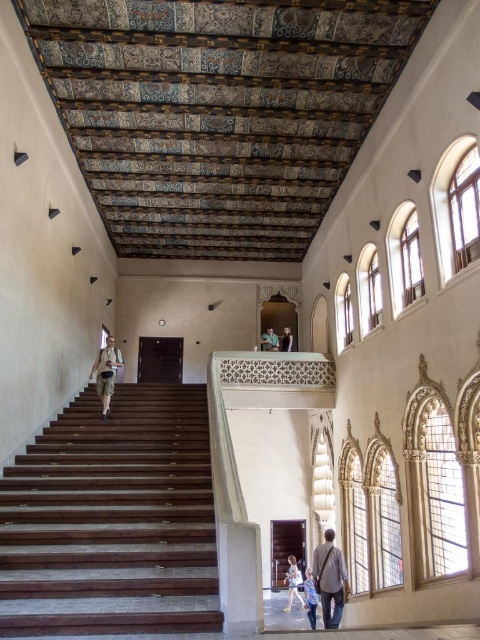
You are standing in the grand staircase area and see both the denim jacket at lower right and the light brown leather jacket at lower center. Which jacket is nearer to you?

The denim jacket at lower right is closer to the viewer than the light brown leather jacket at lower center.

You are standing at the bottom of the dark wood stairs at left and want to reach the light brown wooden person at upper center. Based on the size comparison between the two objects, which one is more likely to be closer to you?

The dark wood stairs at left is larger in size than the light brown wooden person at upper center, so the dark wood stairs at left is closer to you since objects closer to the viewer appear larger.